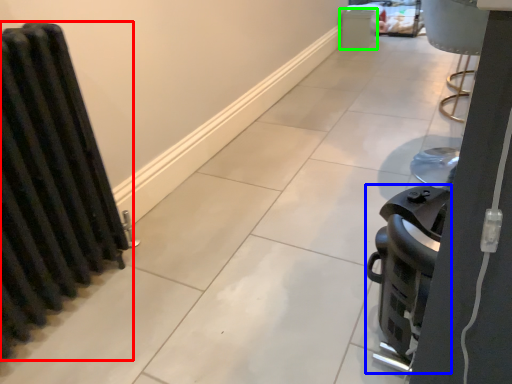
Question: Based on their relative distances, which object is nearer to radiator (highlighted by a red box)? Choose from appliance (highlighted by a blue box) and appliance (highlighted by a green box).

Choices:
 (A) appliance
 (B) appliance

Answer: (A)